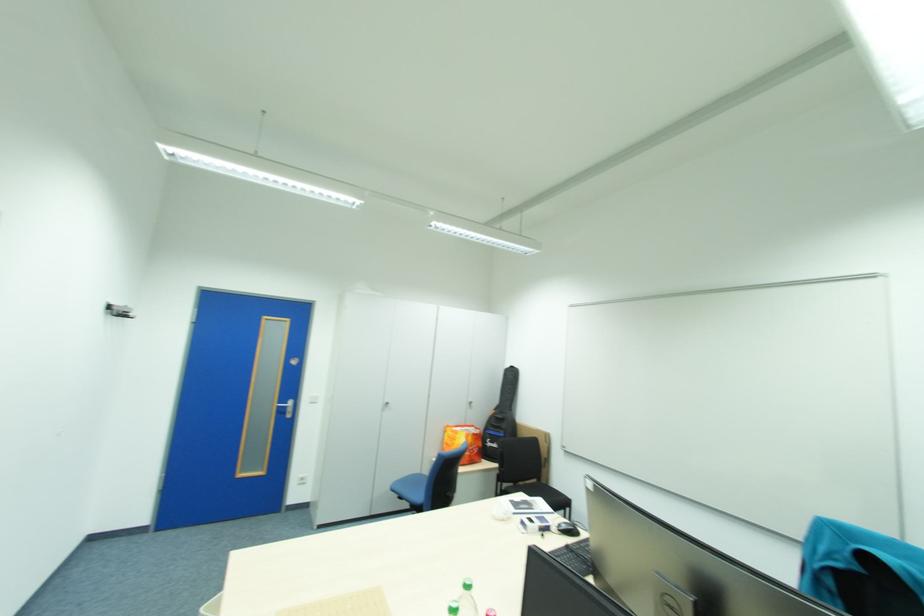
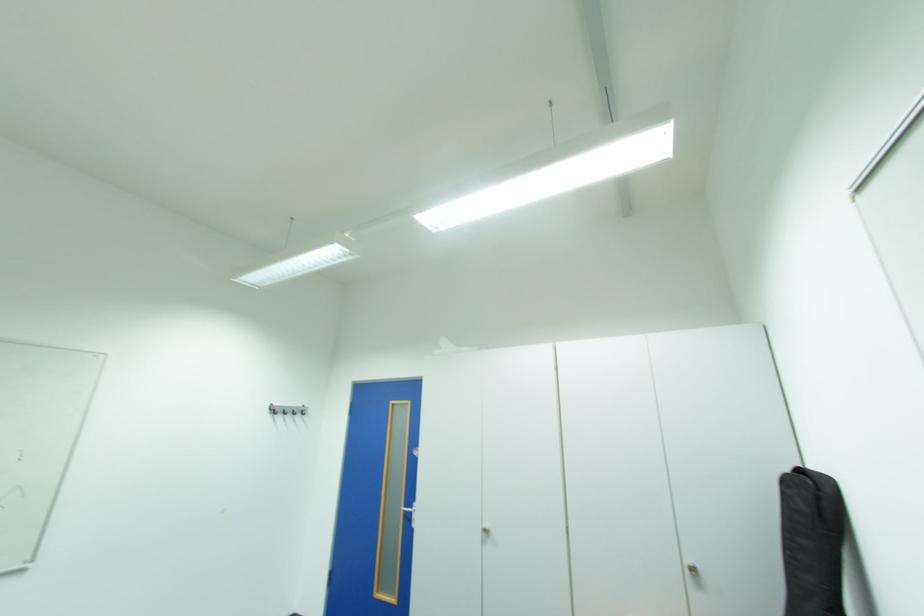
Where in the second image is the point corresponding to point (286, 407) from the first image?

(414, 511)